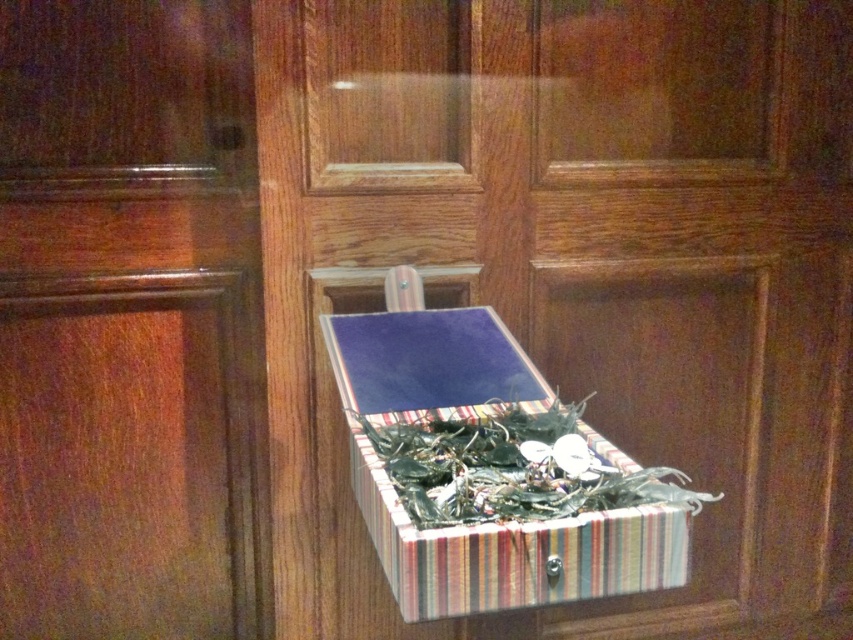
Is glossy wood door at center closer to camera compared to striped fabric box at center?

No, glossy wood door at center is behind striped fabric box at center.

This screenshot has height=640, width=853. What do you see at coordinates (129, 323) in the screenshot? I see `glossy wood door at center` at bounding box center [129, 323].

Which is in front, point (15, 314) or point (561, 525)?

Point (561, 525) is in front.

I want to click on glossy wood door at center, so click(x=129, y=323).

In the scene shown: Is wooden door at center thinner than striped fabric box at center?

Incorrect, wooden door at center's width is not less than striped fabric box at center's.

Can you confirm if wooden door at center is smaller than striped fabric box at center?

No.

The image size is (853, 640). What do you see at coordinates (577, 272) in the screenshot?
I see `wooden door at center` at bounding box center [577, 272].

Identify the location of wooden door at center. The height and width of the screenshot is (640, 853). (577, 272).

Is point (744, 20) closer to camera compared to point (86, 97)?

No, (744, 20) is behind (86, 97).

This screenshot has width=853, height=640. What do you see at coordinates (577, 272) in the screenshot?
I see `wooden door at center` at bounding box center [577, 272].

What are the coordinates of `wooden door at center` in the screenshot? It's located at (577, 272).